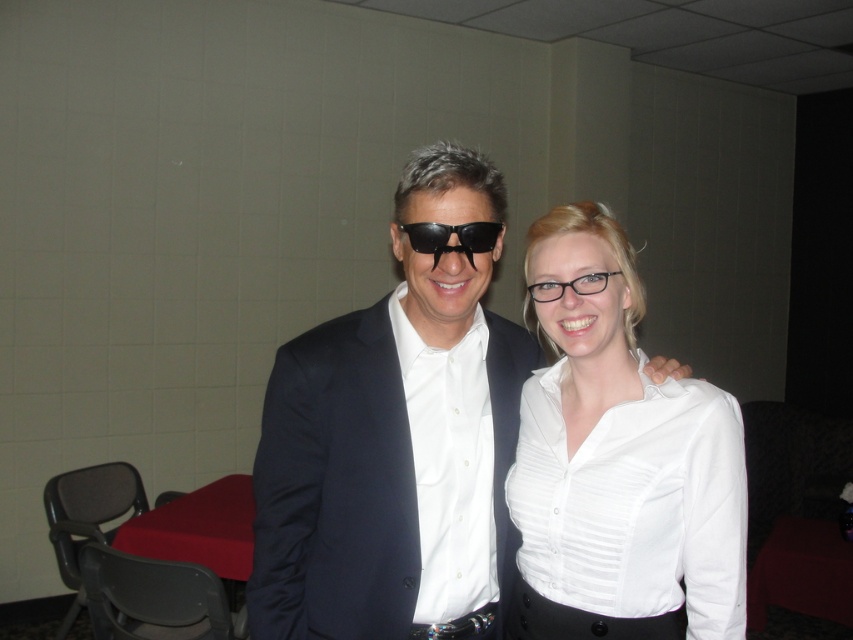
Question: Which of the following is the farthest from the observer?

Choices:
 (A) satin black suit at center
 (B) white glossy shirt at center

Answer: (A)

Question: Does white glossy shirt at center have a larger size compared to satin black suit at center?

Choices:
 (A) yes
 (B) no

Answer: (B)

Question: Does matte black suit at center have a larger size compared to black plastic sunglasses at center?

Choices:
 (A) yes
 (B) no

Answer: (A)

Question: Can you confirm if matte black suit at center is bigger than satin black suit at center?

Choices:
 (A) no
 (B) yes

Answer: (B)

Question: Which of the following is the farthest from the observer?

Choices:
 (A) coord(677,442)
 (B) coord(448,236)
 (C) coord(410,556)

Answer: (C)

Question: Which object appears farthest from the camera in this image?

Choices:
 (A) black plastic sunglasses at center
 (B) satin black suit at center
 (C) matte black suit at center

Answer: (B)